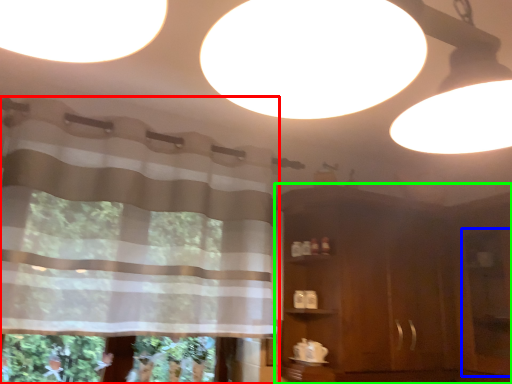
Question: Which object is positioned closest to curtain (highlighted by a red box)? Select from screen door (highlighted by a blue box) and dresser (highlighted by a green box).

Choices:
 (A) screen door
 (B) dresser

Answer: (B)